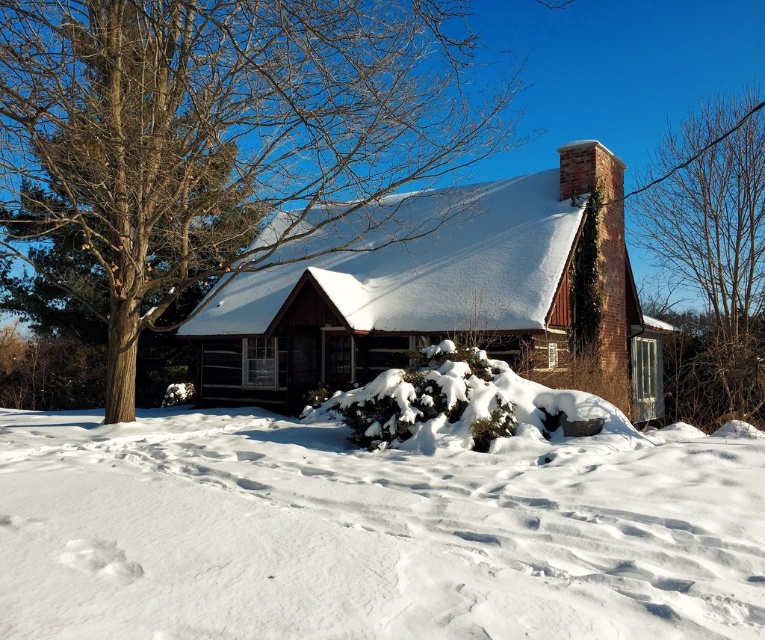
You are a delivery person approaching the brown wooden cabin at center. You see the white fluffy snow at lower center. Where is the snow located relative to the cabin?

→ The white fluffy snow at lower center is positioned under the brown wooden cabin at center, so the snow is directly beneath the cabin.